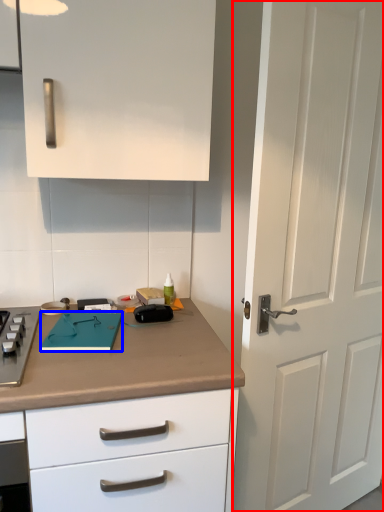
Question: Which point is closer to the camera, door (highlighted by a red box) or notepad (highlighted by a blue box)?

Choices:
 (A) door
 (B) notepad

Answer: (A)